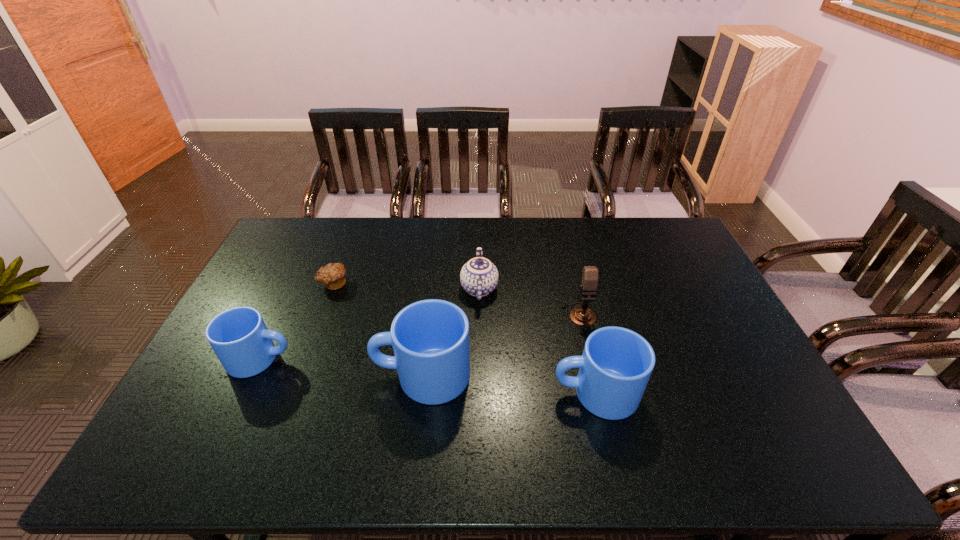
Identify the location of free space at the left edge of the desktop. The image size is (960, 540). (290, 291).

Find the location of a particular element. This screenshot has width=960, height=540. free space at the right edge of the desktop is located at coordinates (694, 275).

In the image, there is a desktop. At what (x,y) coordinates should I click in order to perform the action: click on vacant space at the far right corner. Please return your answer as a coordinate pair (x, y). Image resolution: width=960 pixels, height=540 pixels. Looking at the image, I should click on (680, 249).

The height and width of the screenshot is (540, 960). What are the coordinates of `vacant area that lies between the microphone and the shortest object` in the screenshot? It's located at (456, 299).

The image size is (960, 540). Identify the location of vacant point located between the muffin and the microphone. (456, 299).

Where is `vacant area between the second mug from left to right and the second tallest mug`? The width and height of the screenshot is (960, 540). vacant area between the second mug from left to right and the second tallest mug is located at coordinates (509, 384).

Identify the location of free spot between the shortest object and the second mug from right to left. (377, 329).

Find the location of a particular element. Image resolution: width=960 pixels, height=540 pixels. free space that is in between the microphone and the chinaware is located at coordinates (529, 301).

I want to click on free spot between the chinaware and the rightmost mug, so click(538, 341).

Where is `object that can be found as the second closest to the muffin`? This screenshot has height=540, width=960. object that can be found as the second closest to the muffin is located at coordinates (430, 338).